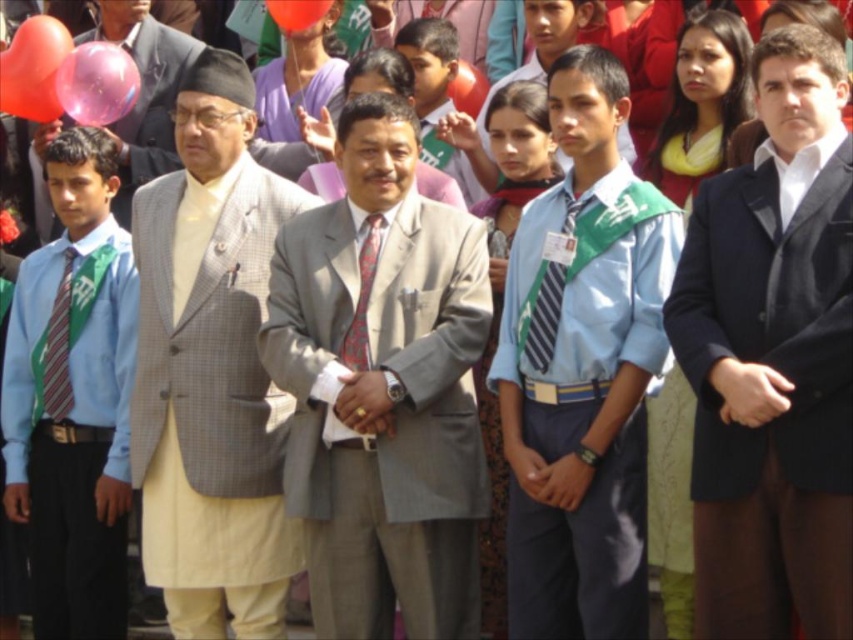
Question: Is blue fabric shirt at center to the left of striped fabric tie at left from the viewer's perspective?

Choices:
 (A) no
 (B) yes

Answer: (A)

Question: Which of the following is the farthest from the observer?

Choices:
 (A) striped fabric tie at center
 (B) light brown fabric suit at center

Answer: (B)

Question: Is gray suit at center above translucent pink balloon at upper left?

Choices:
 (A) no
 (B) yes

Answer: (A)

Question: Is matte blue shirt at center to the right of striped fabric tie at left from the viewer's perspective?

Choices:
 (A) yes
 (B) no

Answer: (A)

Question: Based on their relative distances, which object is farther from the patterned silk tie at center?

Choices:
 (A) matte gray suit at center
 (B) striped fabric tie at left

Answer: (A)

Question: Among these objects, which one is nearest to the camera?

Choices:
 (A) blue fabric shirt at center
 (B) yellow-green uniform at center
 (C) rubber balloon at upper center

Answer: (A)